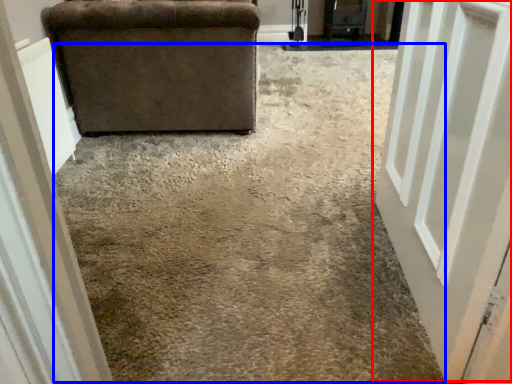
Question: Which of the following is the farthest to the observer, door (highlighted by a red box) or concrete (highlighted by a blue box)?

Choices:
 (A) door
 (B) concrete

Answer: (B)